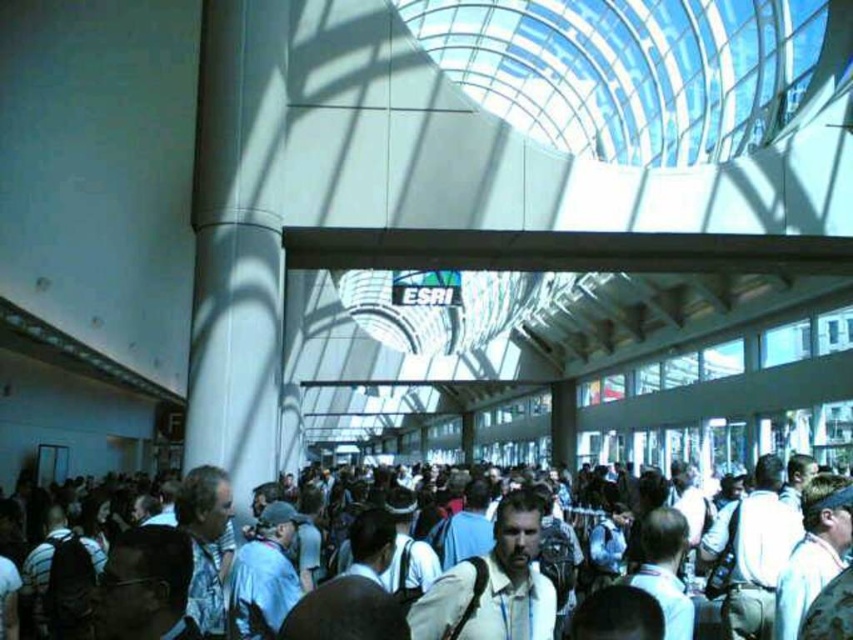
Question: Is white fabric crowd at center smaller than light beige shirt at center?

Choices:
 (A) yes
 (B) no

Answer: (B)

Question: Which object is closer to the camera taking this photo?

Choices:
 (A) light beige shirt at center
 (B) white fabric crowd at center

Answer: (B)

Question: Is white fabric crowd at center above light beige shirt at center?

Choices:
 (A) yes
 (B) no

Answer: (B)

Question: Among these objects, which one is nearest to the camera?

Choices:
 (A) white fabric crowd at center
 (B) light beige shirt at center

Answer: (A)

Question: Is white fabric crowd at center bigger than light beige shirt at center?

Choices:
 (A) no
 (B) yes

Answer: (B)

Question: Among these objects, which one is nearest to the camera?

Choices:
 (A) light beige shirt at center
 (B) white fabric crowd at center

Answer: (B)